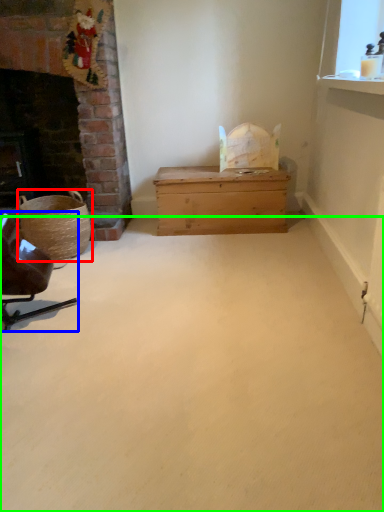
Question: Based on their relative distances, which object is farther from basket (highlighted by a red box)? Choose from chair (highlighted by a blue box) and plain (highlighted by a green box).

Choices:
 (A) chair
 (B) plain

Answer: (B)